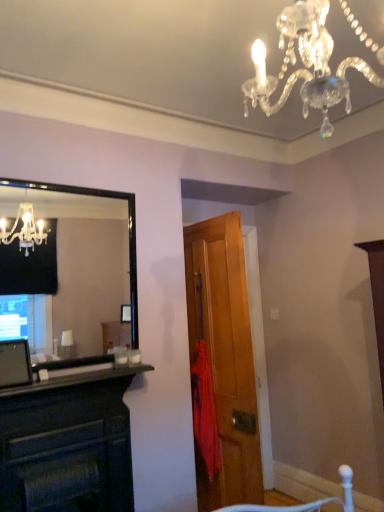
Question: Considering the relative positions of black glass mirror at left and clear crystal chandelier at upper center in the image provided, is black glass mirror at left to the right of clear crystal chandelier at upper center from the viewer's perspective?

Choices:
 (A) no
 (B) yes

Answer: (A)

Question: Is black glass mirror at left positioned before clear crystal chandelier at upper center?

Choices:
 (A) yes
 (B) no

Answer: (B)

Question: Is black glass mirror at left not close to clear crystal chandelier at upper center?

Choices:
 (A) no
 (B) yes

Answer: (B)

Question: From a real-world perspective, does black glass mirror at left sit lower than clear crystal chandelier at upper center?

Choices:
 (A) no
 (B) yes

Answer: (B)

Question: Is black glass mirror at left thinner than clear crystal chandelier at upper center?

Choices:
 (A) no
 (B) yes

Answer: (B)

Question: From a real-world perspective, is black glass mirror at left positioned over clear crystal chandelier at upper center based on gravity?

Choices:
 (A) yes
 (B) no

Answer: (B)

Question: Could you tell me if red fabric umbrella at center is facing dark wood fireplace at left?

Choices:
 (A) yes
 (B) no

Answer: (A)

Question: Can you confirm if red fabric umbrella at center is positioned to the right of dark wood fireplace at left?

Choices:
 (A) yes
 (B) no

Answer: (A)

Question: Can you confirm if red fabric umbrella at center is wider than dark wood fireplace at left?

Choices:
 (A) no
 (B) yes

Answer: (A)

Question: Is red fabric umbrella at center outside of dark wood fireplace at left?

Choices:
 (A) yes
 (B) no

Answer: (A)

Question: Considering the relative sizes of red fabric umbrella at center and dark wood fireplace at left in the image provided, is red fabric umbrella at center taller than dark wood fireplace at left?

Choices:
 (A) no
 (B) yes

Answer: (B)

Question: Is red fabric umbrella at center positioned with its back to dark wood fireplace at left?

Choices:
 (A) yes
 (B) no

Answer: (B)

Question: Can you confirm if wooden door at center is shorter than black matte fireplace at lower left?

Choices:
 (A) yes
 (B) no

Answer: (B)